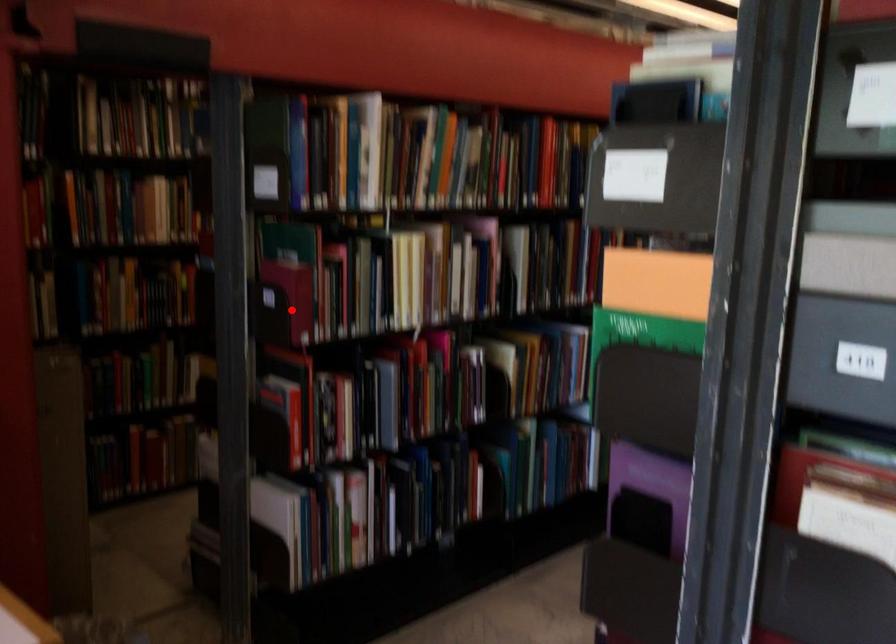
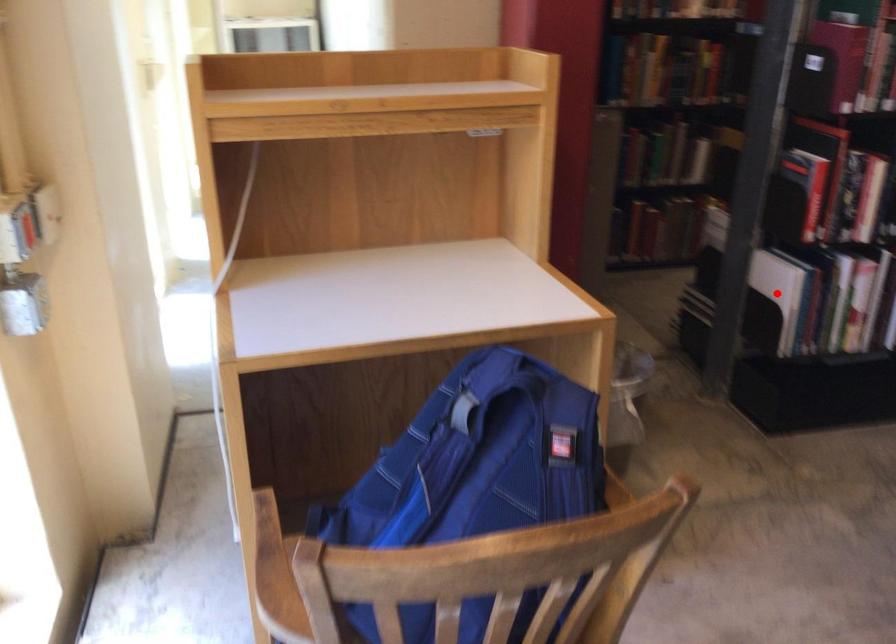
I am providing you with two images of the same scene from different viewpoints. A red point is marked on the first image and another point is marked on the second image. Are the points marked in image1 and image2 representing the same 3D position?

No